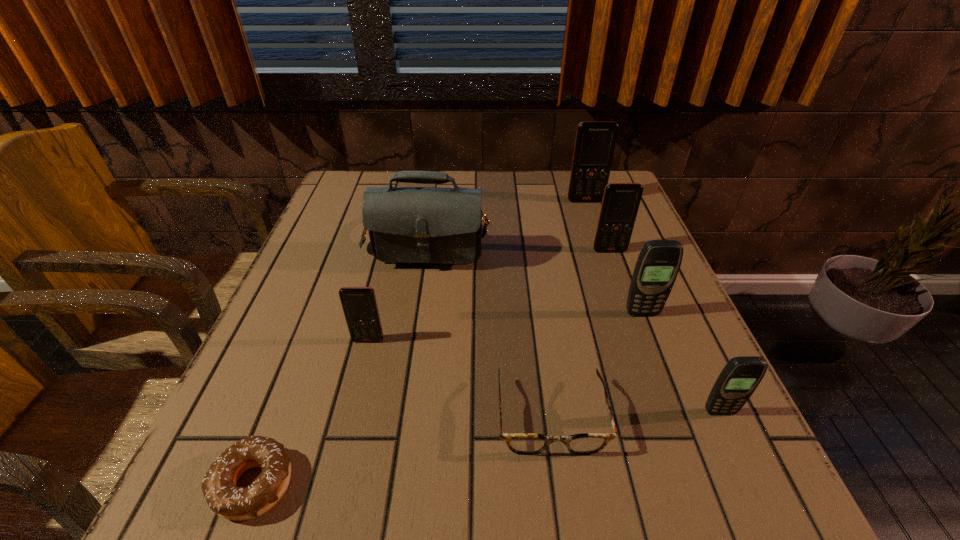
This screenshot has height=540, width=960. What are the coordinates of `the nearest cellular telephone` in the screenshot? It's located at (738, 380).

You are a GUI agent. You are given a task and a screenshot of the screen. Output one action in this format:
    pyautogui.click(x=<x>, y=<y>)
    Task: Click on the fifth object from right to left
    This screenshot has width=960, height=540.
    Given the screenshot: What is the action you would take?
    pyautogui.click(x=520, y=443)

Identify the location of doughnut. This screenshot has height=540, width=960. tap(219, 486).

This screenshot has height=540, width=960. What are the coordinates of `vacant space positioned on the screen of the biggest orange cellular telephone` in the screenshot? It's located at (619, 299).

The image size is (960, 540). In order to click on free space located 0.080m on the left of the shoulder bag in this screenshot , I will do `click(336, 231)`.

Locate an element on the screen. This screenshot has width=960, height=540. vacant area located on the screen of the fifth nearest object is located at coordinates (674, 398).

Image resolution: width=960 pixels, height=540 pixels. Identify the location of vacant space situated 0.200m on the screen of the second smallest orange cellular telephone. (633, 314).

This screenshot has height=540, width=960. I want to click on free point located 0.280m on the screen of the leftmost orange cellular telephone, so (x=330, y=495).

Locate an element on the screen. vacant space located on the screen of the nearer gray cellular telephone is located at coordinates [x=756, y=490].

Identify the location of vacant space located on the frame of the spectacles. Image resolution: width=960 pixels, height=540 pixels. (562, 497).